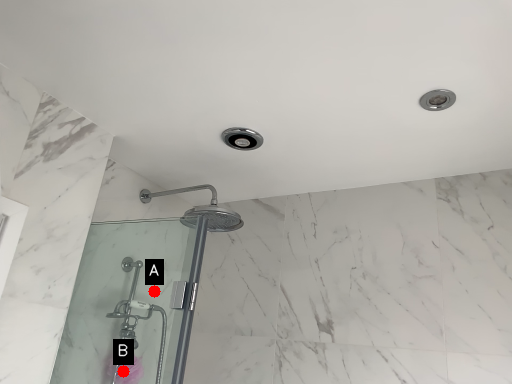
Question: Two points are circled on the image, labeled by A and B beside each circle. Which of the following is the closest to the observer?

Choices:
 (A) A is closer
 (B) B is closer

Answer: (B)